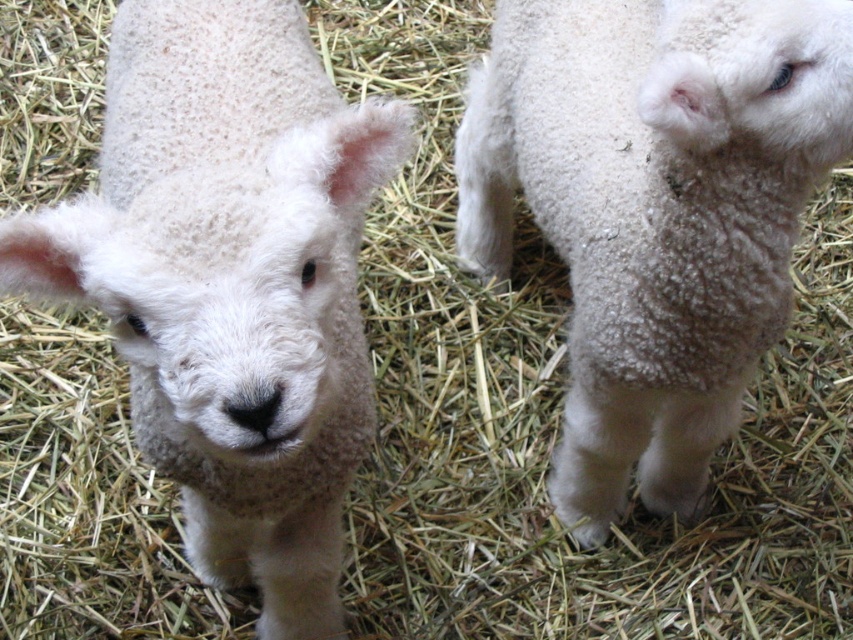
You are a farmer checking the lamb pens. You notice two lambs in the same pen. Which lamb is closer to you, the white woolen lamb at center or the white fluffy lamb at center?

The white woolen lamb at center is closer to you because it is positioned under the white fluffy lamb at center, meaning it is in front of the other lamb.

You are a farmer who needs to measure the distance between the two lambs in the image. You have a measuring tape that can only extend 15 inches. Can you accurately measure the distance between the white woolen lamb at center and the white fluffy lamb at center with your current tool?

The distance between the white woolen lamb at center and the white fluffy lamb at center is 17.27 inches. Since your measuring tape can only extend 15 inches, it is not long enough to measure the distance between them accurately.

You are a photographer trying to capture the lambs in the image. You want to focus on the lamb that is closer to the camera. Which of the two points, point (119, 285) or point (480, 198), should you aim your camera at to ensure the closest lamb is in focus?

Point (119, 285) is closer to the camera than point (480, 198), so you should aim your camera at point (119, 285) to focus on the closer lamb.